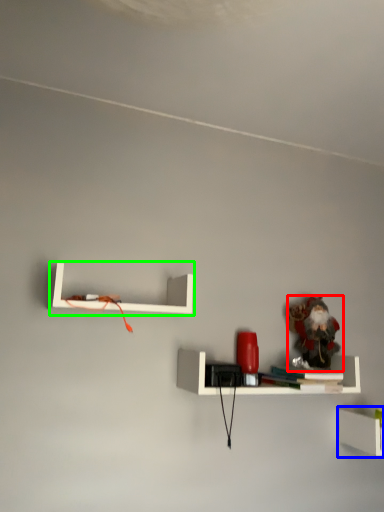
Question: Estimate the real-world distances between objects in this image. Which object is farther from toy (highlighted by a red box), shelf (highlighted by a blue box) or shelf (highlighted by a green box)?

Choices:
 (A) shelf
 (B) shelf

Answer: (B)